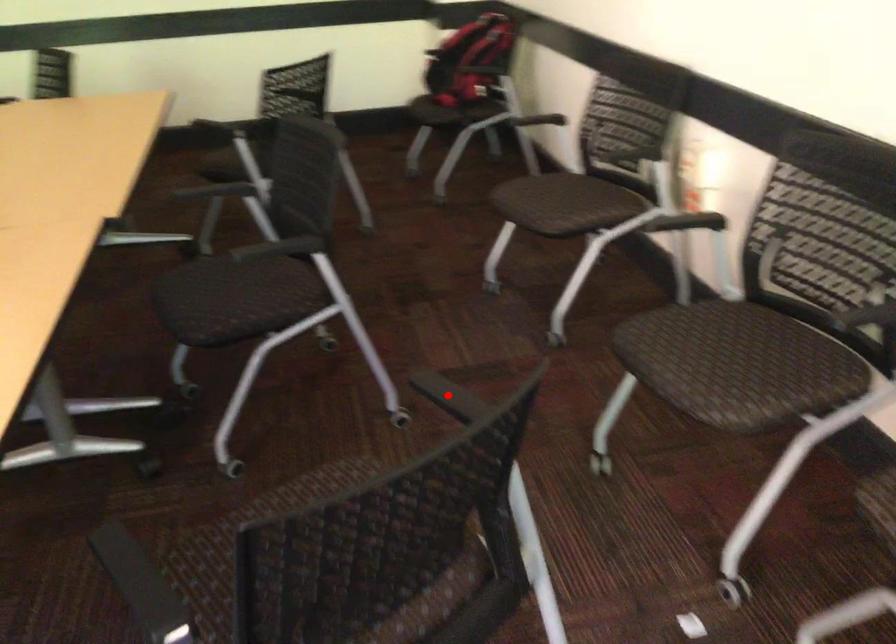
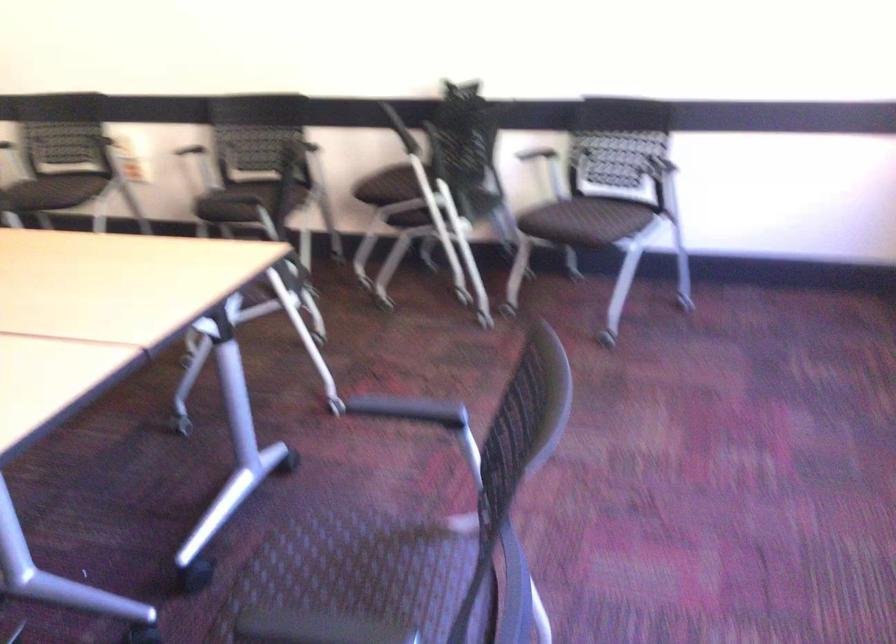
Question: I am providing you with two images of the same scene from different viewpoints. A red point is marked on the first image. At the location where the point appears in image 1, is it still visible in image 2?

Choices:
 (A) Yes
 (B) No

Answer: (B)